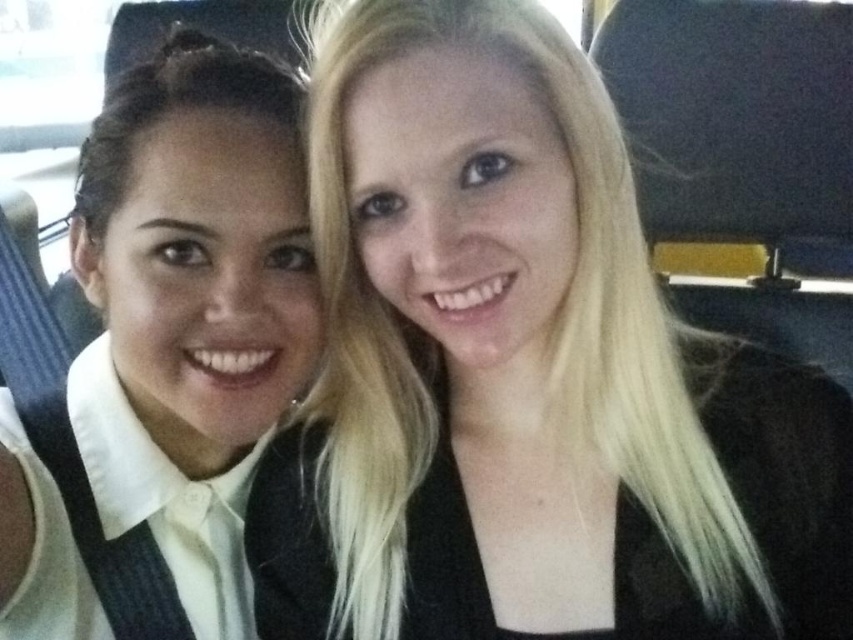
You are a photographer trying to capture a closeup of the blonde hair at upper right in the image. Based on its 2D coordinates, where should you focus your camera? Please provide the coordinates in the format of a point like this example format for clarity and precision.

The blonde hair at upper right is located at point coordinates of (524, 374). You should focus your camera there to capture the closeup.

You are a photographer trying to focus on the white matte shirt at left in a dimly lit vehicle interior. Based on the coordinates provided, where should you position your camera to ensure the shirt is in the center of the frame?

The white matte shirt at left is located at coordinates point (167, 355), so positioning the camera to center on these coordinates will ensure the shirt is centered in the frame.